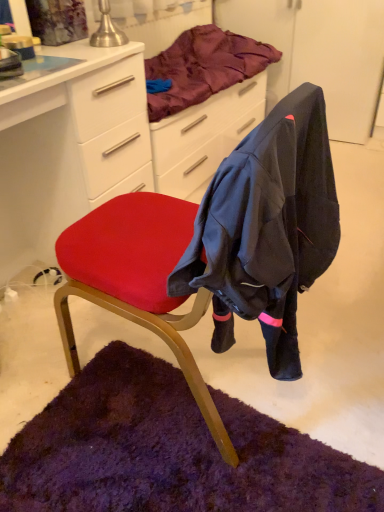
Question: Does satin purple blanket at upper center have a greater width compared to velvet red chair at center?

Choices:
 (A) yes
 (B) no

Answer: (B)

Question: From the image's perspective, would you say satin purple blanket at upper center is shown under velvet red chair at center?

Choices:
 (A) no
 (B) yes

Answer: (A)

Question: Is satin purple blanket at upper center positioned behind velvet red chair at center?

Choices:
 (A) no
 (B) yes

Answer: (B)

Question: Is satin purple blanket at upper center closer to the viewer compared to velvet red chair at center?

Choices:
 (A) yes
 (B) no

Answer: (B)

Question: From a real-world perspective, is satin purple blanket at upper center positioned over velvet red chair at center based on gravity?

Choices:
 (A) no
 (B) yes

Answer: (B)

Question: Would you say velvet red chair at center is inside or outside matte white desk at center?

Choices:
 (A) outside
 (B) inside

Answer: (A)

Question: Considering the relative positions of velvet red chair at center and matte white desk at center in the image provided, is velvet red chair at center to the left or to the right of matte white desk at center?

Choices:
 (A) right
 (B) left

Answer: (A)

Question: From the image's perspective, is velvet red chair at center located above or below matte white desk at center?

Choices:
 (A) above
 (B) below

Answer: (B)

Question: From a real-world perspective, relative to matte white desk at center, is velvet red chair at center vertically above or below?

Choices:
 (A) below
 (B) above

Answer: (B)

Question: Considering their positions, is matte white desk at center located in front of or behind satin purple blanket at upper center?

Choices:
 (A) front
 (B) behind

Answer: (A)

Question: From their relative heights in the image, would you say matte white desk at center is taller or shorter than satin purple blanket at upper center?

Choices:
 (A) short
 (B) tall

Answer: (B)

Question: Visually, is matte white desk at center positioned to the left or to the right of satin purple blanket at upper center?

Choices:
 (A) right
 (B) left

Answer: (B)

Question: Is matte white desk at center spatially inside satin purple blanket at upper center, or outside of it?

Choices:
 (A) inside
 (B) outside

Answer: (B)

Question: Is satin purple blanket at upper center spatially inside matte white desk at center, or outside of it?

Choices:
 (A) inside
 (B) outside

Answer: (B)

Question: Considering the positions of satin purple blanket at upper center and matte white desk at center in the image, is satin purple blanket at upper center taller or shorter than matte white desk at center?

Choices:
 (A) tall
 (B) short

Answer: (B)